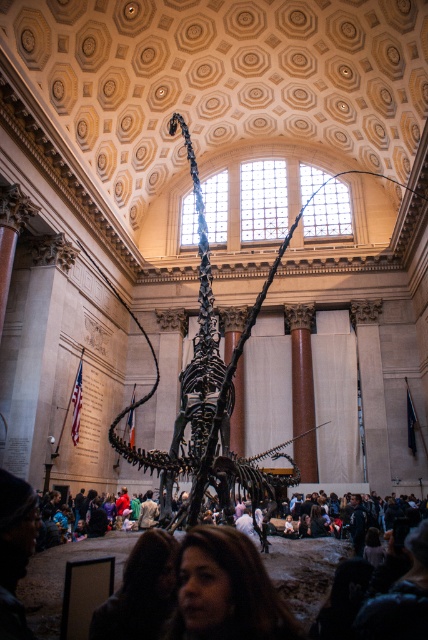
Is shiny metallic dinosaur skeleton at center below brown hair at lower center?

No, shiny metallic dinosaur skeleton at center is not below brown hair at lower center.

Is shiny metallic dinosaur skeleton at center positioned in front of brown hair at lower center?

No, shiny metallic dinosaur skeleton at center is behind brown hair at lower center.

Is point (228, 433) more distant than point (241, 544)?

That is True.

Identify the location of shiny metallic dinosaur skeleton at center. (208, 396).

Is brown hair at lower center to the left of dark clothing crowd at center from the viewer's perspective?

Incorrect, brown hair at lower center is not on the left side of dark clothing crowd at center.

Is brown hair at lower center to the right of dark clothing crowd at center from the viewer's perspective?

Yes, brown hair at lower center is to the right of dark clothing crowd at center.

Does point (187, 552) come in front of point (80, 552)?

Yes, it is.

Where is `brown hair at lower center`? brown hair at lower center is located at coordinates (226, 589).

From the picture: Which is more to the left, shiny metallic dinosaur skeleton at center or dark clothing crowd at center?

dark clothing crowd at center

Locate an element on the screen. The image size is (428, 640). shiny metallic dinosaur skeleton at center is located at coordinates (208, 396).